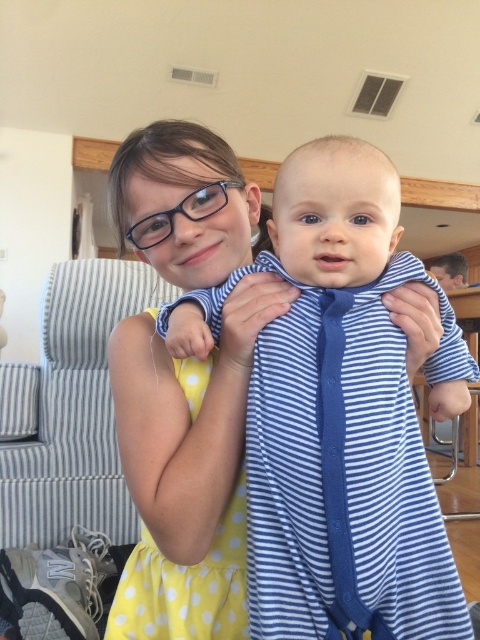
Does blue striped onesie at center have a greater height compared to yellow polka dot dress at center?

Correct, blue striped onesie at center is much taller as yellow polka dot dress at center.

Does blue striped onesie at center have a lesser height compared to yellow polka dot dress at center?

No, blue striped onesie at center is not shorter than yellow polka dot dress at center.

Is point (337, 186) closer to viewer compared to point (202, 394)?

That is True.

The image size is (480, 640). I want to click on blue striped onesie at center, so click(339, 416).